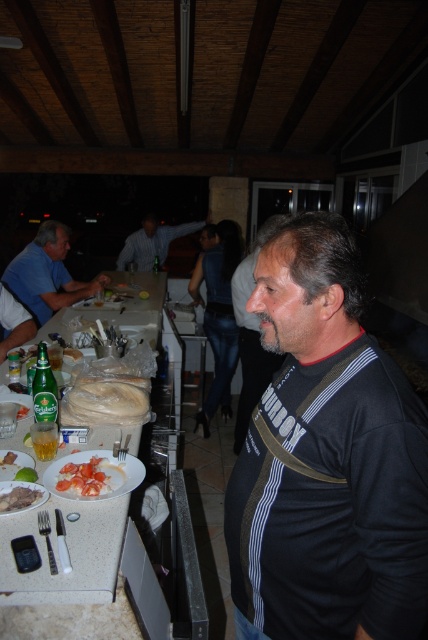
Can you confirm if black jersey at center is positioned to the left of white bread at left?

Incorrect, black jersey at center is not on the left side of white bread at left.

Is black jersey at center thinner than white bread at left?

No.

Identify the location of black jersey at center. This screenshot has width=428, height=640. (326, 460).

This screenshot has height=640, width=428. What are the coordinates of `black jersey at center` in the screenshot? It's located at (326, 460).

Is blue shirt at center to the left of meat at center from the viewer's perspective?

Correct, you'll find blue shirt at center to the left of meat at center.

Does blue shirt at center come behind meat at center?

Yes, it is behind meat at center.

Between point (133, 237) and point (12, 492), which one is positioned behind?

The point (133, 237) is more distant.

Locate an element on the screen. The width and height of the screenshot is (428, 640). blue shirt at center is located at coordinates (152, 241).

Does white bread at left appear under meat at center?

No, white bread at left is not below meat at center.

Who is higher up, white bread at left or meat at center?

white bread at left is above.

Is point (145, 401) closer to camera compared to point (12, 504)?

No, it is behind (12, 504).

I want to click on white bread at left, so click(106, 403).